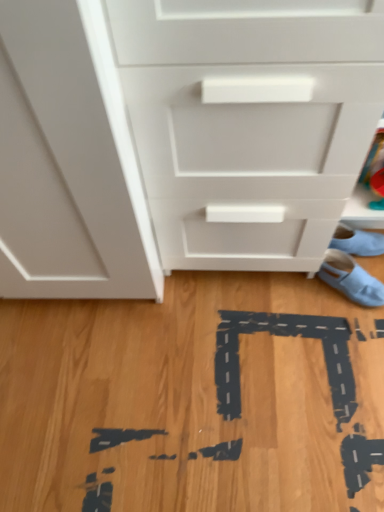
I want to click on vacant space situated on the left part of light blue fabric shoe at lower right, which is counted as the 1th footwear, starting from the top, so click(x=284, y=291).